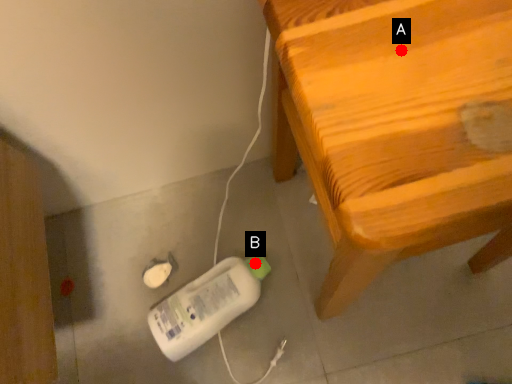
Question: Two points are circled on the image, labeled by A and B beside each circle. Which point is closer to the camera taking this photo?

Choices:
 (A) A is closer
 (B) B is closer

Answer: (A)